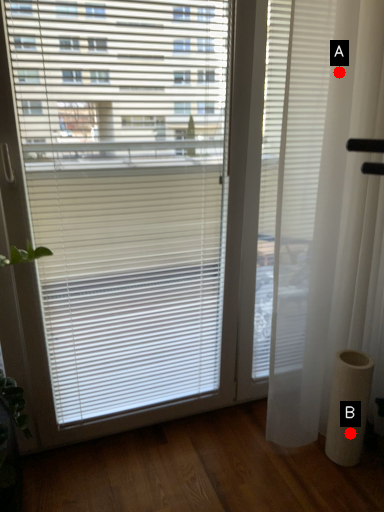
Question: Two points are circled on the image, labeled by A and B beside each circle. Among these points, which one is nearest to the camera?

Choices:
 (A) A is closer
 (B) B is closer

Answer: (A)